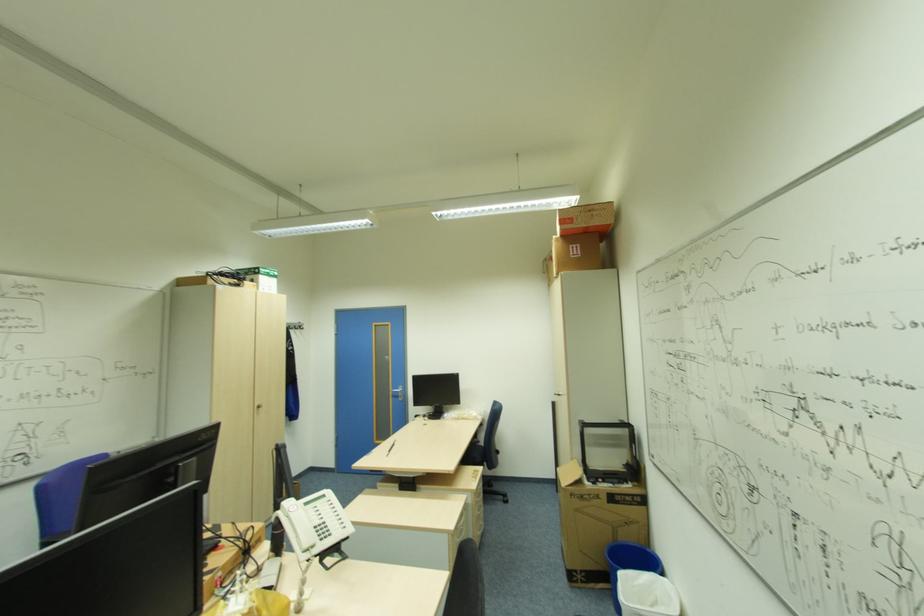
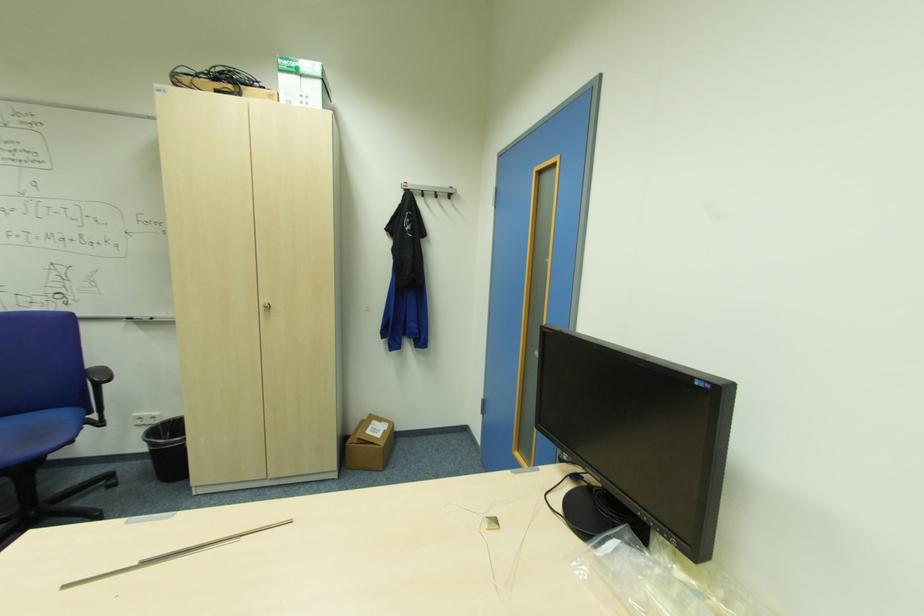
The point at (261,407) is marked in the first image. Where is the corresponding point in the second image?

(271, 307)